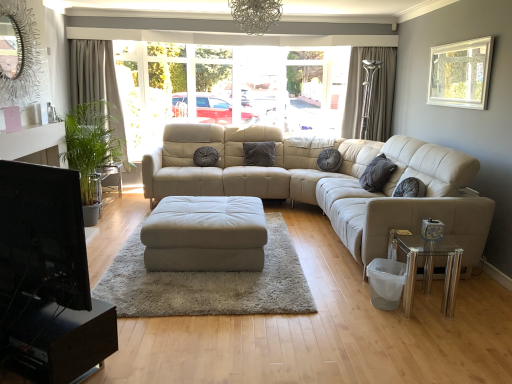
The height and width of the screenshot is (384, 512). I want to click on unoccupied region to the right of transparent glass table at lower right, so click(470, 299).